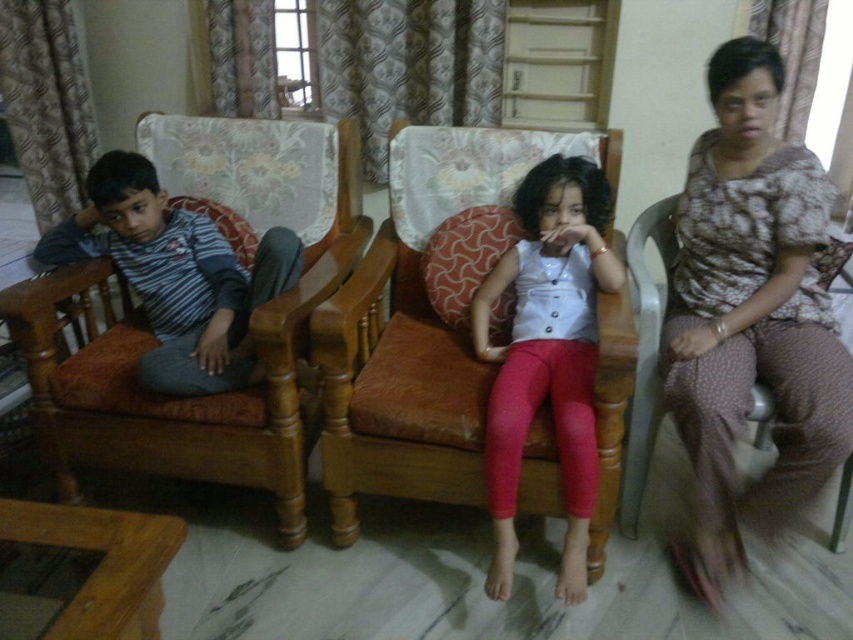
You are a furniture designer evaluating the seating arrangement in this living room. The matte orange cushioned chair at center and the striped cotton shirt at left are part of the design. Which object is taller?

The matte orange cushioned chair at center is taller than the striped cotton shirt at left.

You are a delivery person entering the room and need to place a package on the floor between the printed fabric blouse at right and the matte orange cushioned chair at center. Can you fit the package there?

The matte orange cushioned chair at center is behind the printed fabric blouse at right, so there is space between them on the floor where the package can be placed.